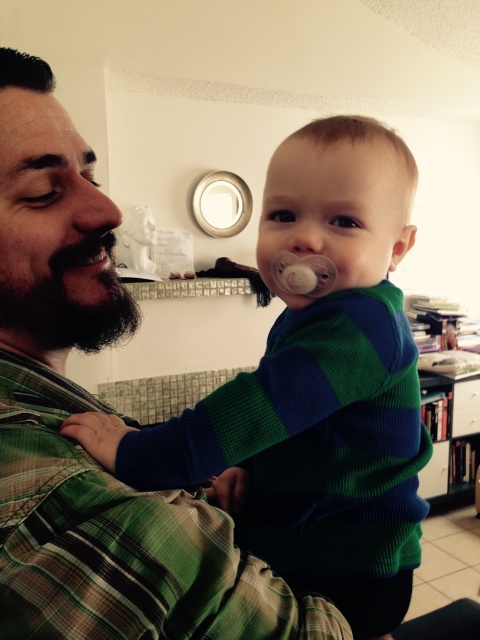
Question: Does green striped sweater at upper center have a larger size compared to black fuzzy beard at left?

Choices:
 (A) yes
 (B) no

Answer: (A)

Question: In this image, where is black fuzzy beard at left located relative to black matte beard at left?

Choices:
 (A) left
 (B) right

Answer: (B)

Question: Which object appears closest to the camera in this image?

Choices:
 (A) black matte beard at left
 (B) black fuzzy beard at left
 (C) green striped sweater at upper center

Answer: (C)

Question: In this image, where is green striped sweater at upper center located relative to black fuzzy beard at left?

Choices:
 (A) right
 (B) left

Answer: (A)

Question: Which is farther from the green striped sweater at upper center?

Choices:
 (A) black fuzzy beard at left
 (B) black matte beard at left

Answer: (B)

Question: Which point is closer to the camera taking this photo?

Choices:
 (A) (25, 291)
 (B) (76, 256)
 (C) (285, 566)

Answer: (A)